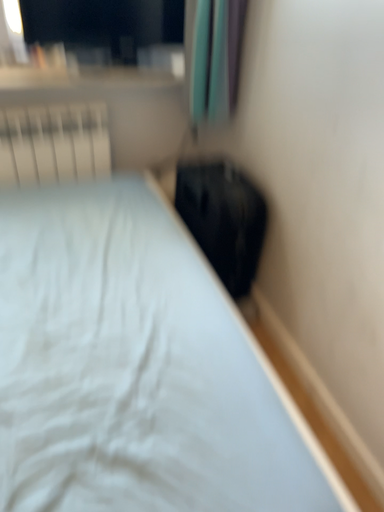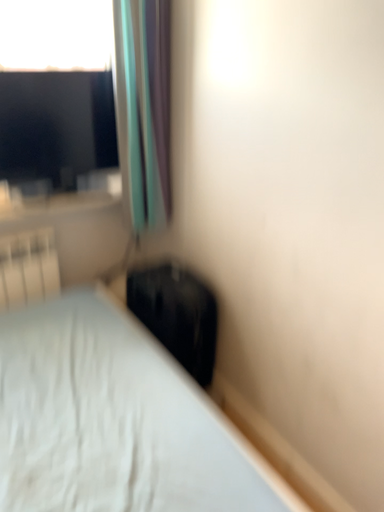
Question: Which way did the camera rotate in the video?

Choices:
 (A) rotated left
 (B) rotated right

Answer: (B)